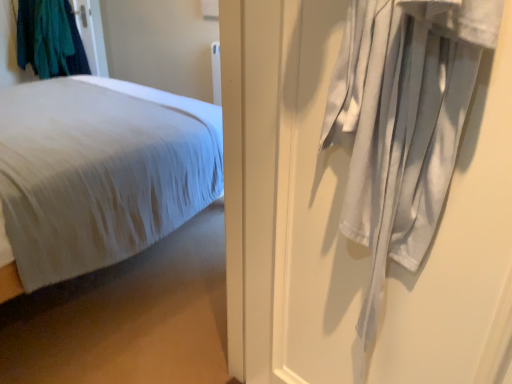
Question: Does white cotton curtain at right have a greater width compared to teal fabric at upper left?

Choices:
 (A) no
 (B) yes

Answer: (A)

Question: Can you confirm if white cotton curtain at right is positioned to the right of teal fabric at upper left?

Choices:
 (A) no
 (B) yes

Answer: (B)

Question: Considering the relative sizes of white cotton curtain at right and teal fabric at upper left in the image provided, is white cotton curtain at right shorter than teal fabric at upper left?

Choices:
 (A) no
 (B) yes

Answer: (A)

Question: Can teal fabric at upper left be found inside white cotton curtain at right?

Choices:
 (A) yes
 (B) no

Answer: (B)

Question: Is white cotton curtain at right further to the viewer compared to teal fabric at upper left?

Choices:
 (A) yes
 (B) no

Answer: (B)

Question: Is white cotton curtain at right taller or shorter than teal fabric at upper left?

Choices:
 (A) tall
 (B) short

Answer: (A)

Question: From a real-world perspective, is white cotton curtain at right above or below teal fabric at upper left?

Choices:
 (A) above
 (B) below

Answer: (A)

Question: In the image, is white cotton curtain at right positioned in front of or behind teal fabric at upper left?

Choices:
 (A) behind
 (B) front

Answer: (B)

Question: Would you say white cotton curtain at right is inside or outside teal fabric at upper left?

Choices:
 (A) inside
 (B) outside

Answer: (B)

Question: Based on their sizes in the image, would you say white soft bed at left is bigger or smaller than white cotton curtain at right?

Choices:
 (A) small
 (B) big

Answer: (B)

Question: From the image's perspective, is white soft bed at left above or below white cotton curtain at right?

Choices:
 (A) below
 (B) above

Answer: (B)

Question: In terms of height, does white soft bed at left look taller or shorter compared to white cotton curtain at right?

Choices:
 (A) short
 (B) tall

Answer: (A)

Question: Does point (48, 115) appear closer or farther from the camera than point (353, 185)?

Choices:
 (A) farther
 (B) closer

Answer: (A)

Question: Is white cotton curtain at right inside the boundaries of white soft bed at left, or outside?

Choices:
 (A) outside
 (B) inside

Answer: (A)

Question: From the image's perspective, is white cotton curtain at right located above or below white soft bed at left?

Choices:
 (A) below
 (B) above

Answer: (A)